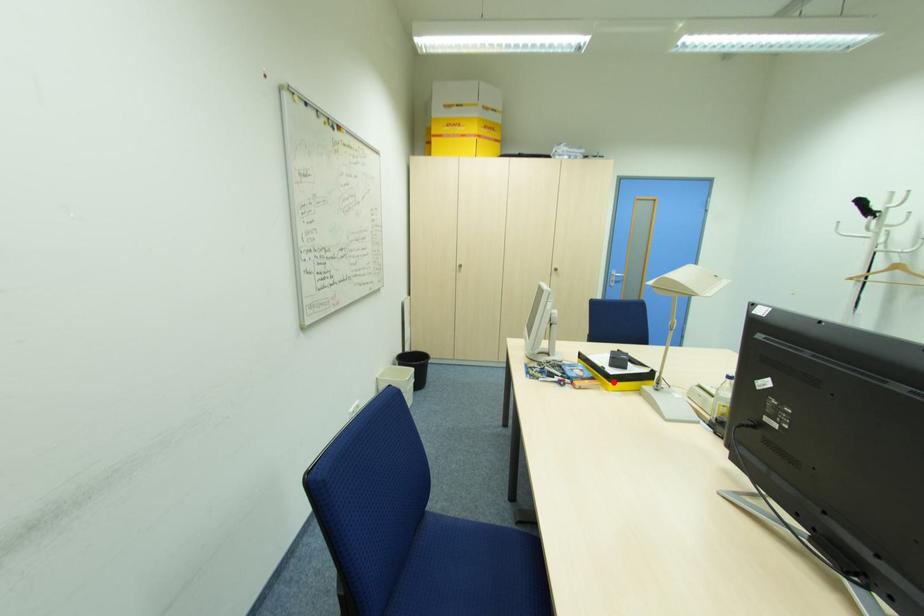
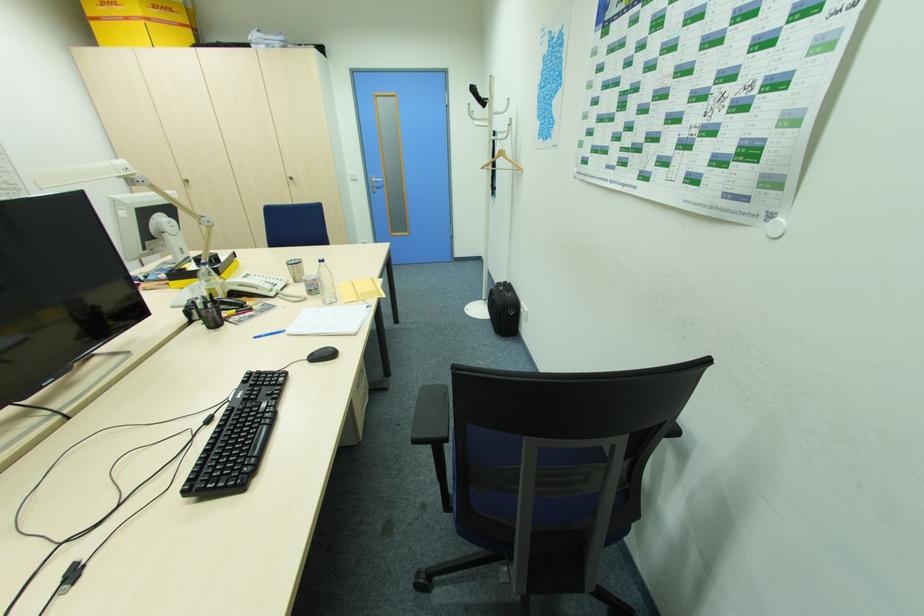
The point at the highlighted location is marked in the first image. Where is the corresponding point in the second image?

(173, 281)